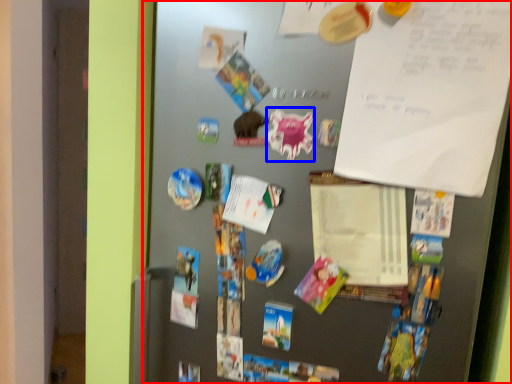
Question: Which of the following is the farthest to the observer, fridge (highlighted by a red box) or art (highlighted by a blue box)?

Choices:
 (A) fridge
 (B) art

Answer: (B)